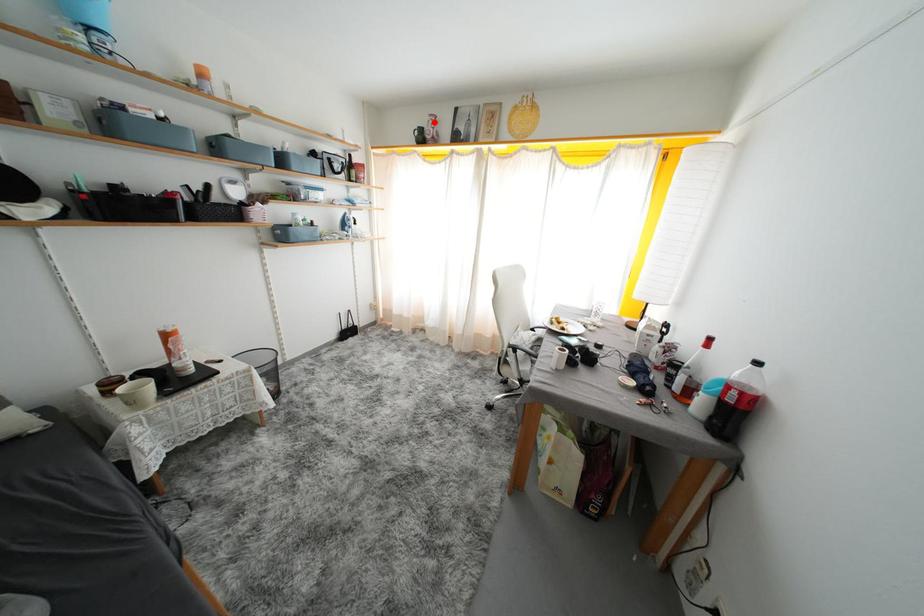
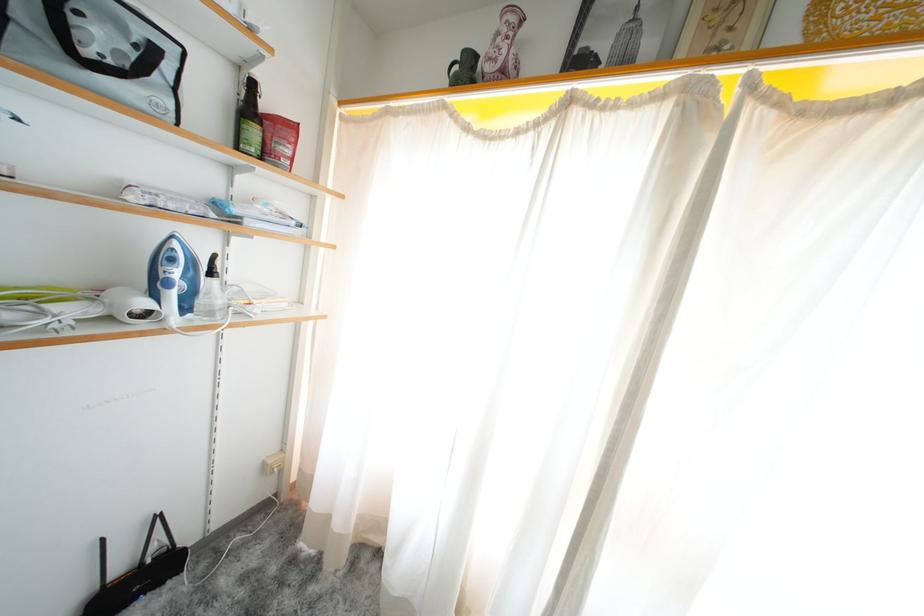
The point at the highlighted location is marked in the first image. Where is the corresponding point in the second image?

(504, 28)